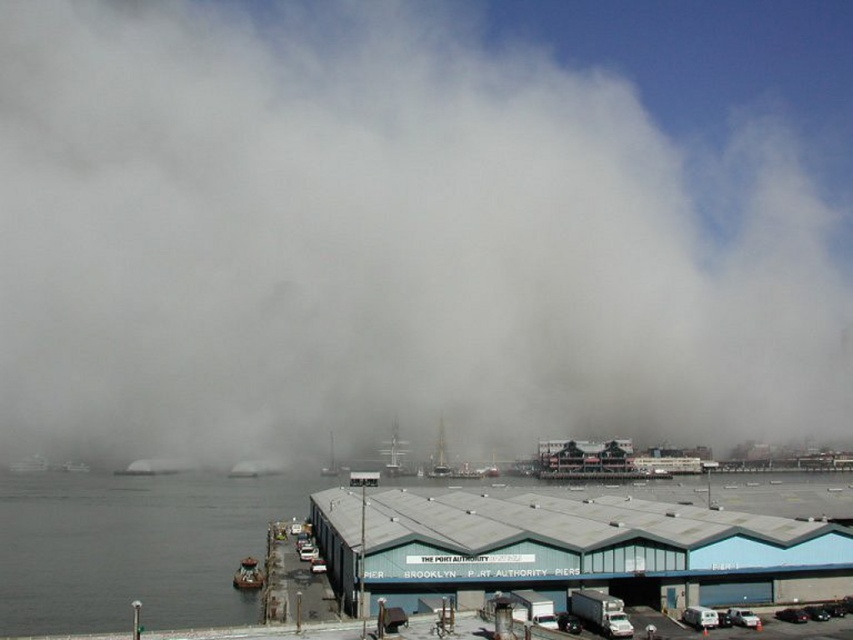
Who is more distant from viewer, (289, 512) or (329, 444)?

Point (329, 444)

Does gray matte water at lower left appear over white wooden sailboat at center?

Correct, gray matte water at lower left is located above white wooden sailboat at center.

Which is in front, point (83, 524) or point (334, 449)?

Point (83, 524) is more forward.

Find the location of a particular element. The width and height of the screenshot is (853, 640). gray matte water at lower left is located at coordinates (134, 547).

Who is more distant from viewer, [416,499] or [288,497]?

The point [288,497] is more distant.

Is gray metal dock at lower center taller than gray matte water at lower left?

Incorrect, gray metal dock at lower center's height is not larger of gray matte water at lower left's.

The image size is (853, 640). I want to click on gray metal dock at lower center, so click(x=570, y=548).

Which of these two, white fog at center or metallic gray boat at lower left, stands taller?

Standing taller between the two is white fog at center.

Between point (317, 336) and point (234, 572), which one is positioned behind?

Point (317, 336)

Describe the element at coordinates (379, 250) in the screenshot. I see `white fog at center` at that location.

What are the coordinates of `white fog at center` in the screenshot? It's located at (379, 250).